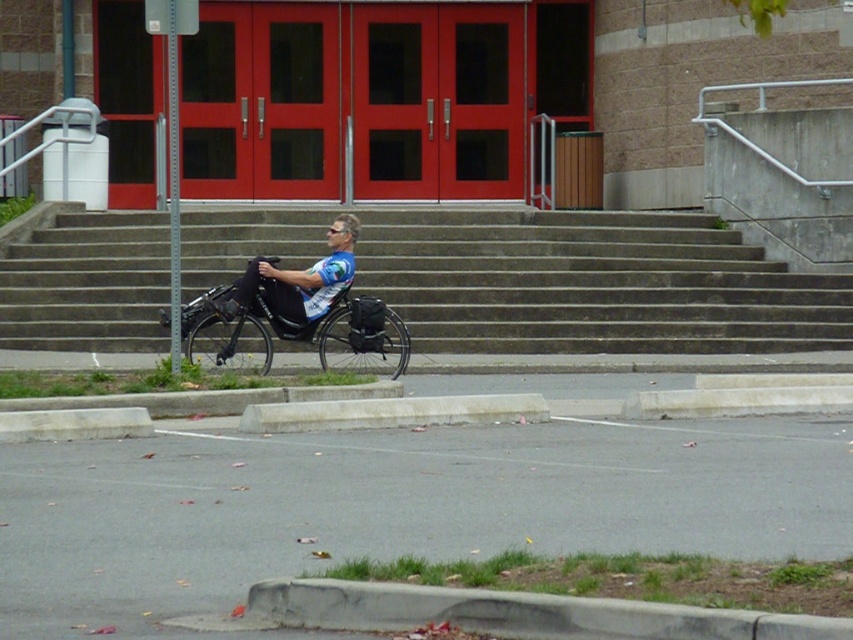
You are a person in a wheelchair who wants to enter the building through the red double doors. Based on the scene, can you access the entrance using the concrete stairs at center and the black plastic wheelchair at center?

The concrete stairs at center is located above the black plastic wheelchair at center, meaning there is a height difference between them. Since the wheelchair cannot climb stairs, you cannot access the entrance directly through the concrete stairs at center. You may need to look for an alternative entrance or ramp.

You are a person using a wheelchair and want to approach the building with red double doors. The wheelchair is black plastic wheelchair at center. There are concrete stairs at center nearby. Can you safely navigate the stairs with your wheelchair?

The concrete stairs at center and black plastic wheelchair at center are 11.28 feet apart. However, wheelchair users cannot safely navigate stairs as they require ramps or lifts for accessibility. Therefore, you cannot safely navigate the stairs with your wheelchair.